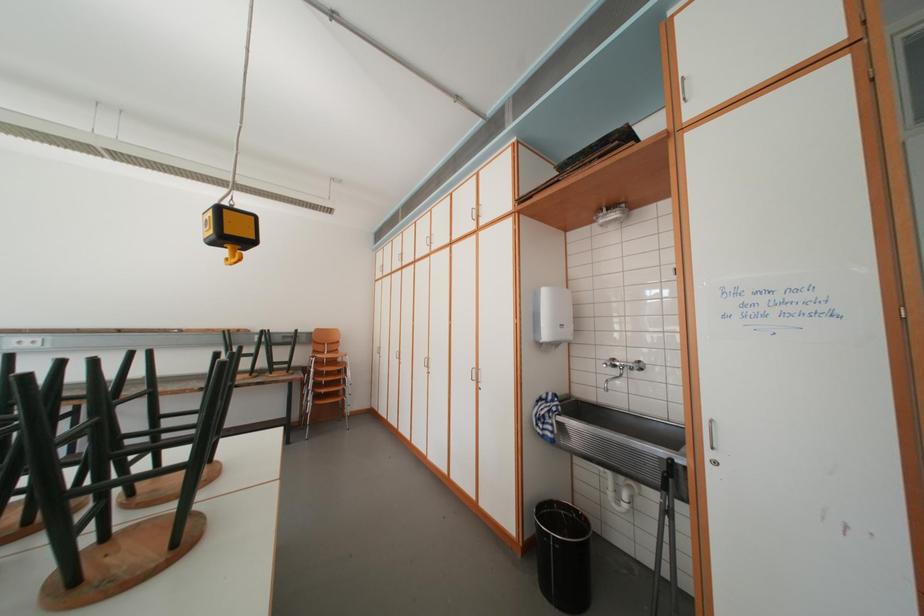
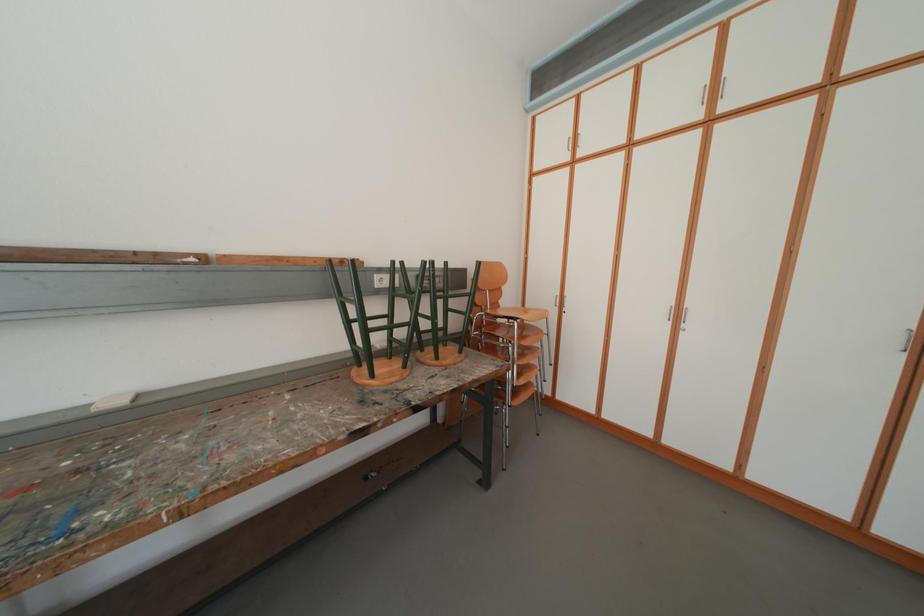
Which direction would the cameraman need to move to produce the second image?

The cameraman walked toward left, forward.